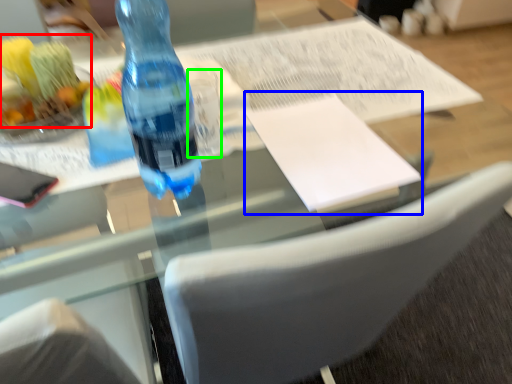
Question: Considering the real-world distances, which object is farthest from food (highlighted by a red box)? journal (highlighted by a blue box) or clear (highlighted by a green box)?

Choices:
 (A) journal
 (B) clear

Answer: (A)